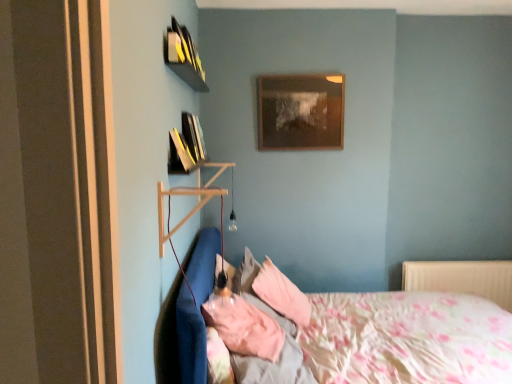
Question: Is pink fabric pillow at center, positioned as the first pillow in front-to-back order, behind fluffy cotton bed at lower left?

Choices:
 (A) yes
 (B) no

Answer: (A)

Question: From the image's perspective, is pink fabric pillow at center, positioned as the first pillow in front-to-back order, above fluffy cotton bed at lower left?

Choices:
 (A) yes
 (B) no

Answer: (A)

Question: From a real-world perspective, is pink fabric pillow at center, the 2th pillow viewed from the back, located beneath fluffy cotton bed at lower left?

Choices:
 (A) no
 (B) yes

Answer: (A)

Question: From the image's perspective, would you say pink fabric pillow at center, the 2th pillow viewed from the back, is shown under fluffy cotton bed at lower left?

Choices:
 (A) yes
 (B) no

Answer: (B)

Question: Can you confirm if pink fabric pillow at center, positioned as the first pillow in front-to-back order, is thinner than fluffy cotton bed at lower left?

Choices:
 (A) yes
 (B) no

Answer: (A)

Question: Considering the relative positions of pink fabric pillow at center, positioned as the first pillow in front-to-back order, and fluffy cotton bed at lower left in the image provided, is pink fabric pillow at center, positioned as the first pillow in front-to-back order, to the left of fluffy cotton bed at lower left from the viewer's perspective?

Choices:
 (A) no
 (B) yes

Answer: (B)

Question: Is pink fabric pillow at center, the 2th pillow viewed from the back, positioned far away from pink fabric pillow at center, arranged as the first pillow when viewed from the back?

Choices:
 (A) no
 (B) yes

Answer: (A)

Question: Considering the relative positions of pink fabric pillow at center, positioned as the first pillow in front-to-back order, and pink fabric pillow at center, which is the 2th pillow from front to back, in the image provided, is pink fabric pillow at center, positioned as the first pillow in front-to-back order, to the right of pink fabric pillow at center, which is the 2th pillow from front to back, from the viewer's perspective?

Choices:
 (A) yes
 (B) no

Answer: (B)

Question: Is pink fabric pillow at center, the 2th pillow viewed from the back, taller than pink fabric pillow at center, which is the 2th pillow from front to back?

Choices:
 (A) no
 (B) yes

Answer: (A)

Question: Considering the relative sizes of pink fabric pillow at center, the 2th pillow viewed from the back, and pink fabric pillow at center, which is the 2th pillow from front to back, in the image provided, is pink fabric pillow at center, the 2th pillow viewed from the back, smaller than pink fabric pillow at center, which is the 2th pillow from front to back,?

Choices:
 (A) yes
 (B) no

Answer: (A)

Question: Is pink fabric pillow at center, positioned as the first pillow in front-to-back order, positioned in front of pink fabric pillow at center, arranged as the first pillow when viewed from the back?

Choices:
 (A) yes
 (B) no

Answer: (A)

Question: From a real-world perspective, is pink fabric pillow at center, the 2th pillow viewed from the back, located higher than pink fabric pillow at center, which is the 2th pillow from front to back?

Choices:
 (A) yes
 (B) no

Answer: (A)

Question: From a real-world perspective, is yellow matte book at upper left, which appears as the 1th book when viewed from the top, on top of pink fabric pillow at center, the 2th pillow viewed from the back?

Choices:
 (A) no
 (B) yes

Answer: (B)